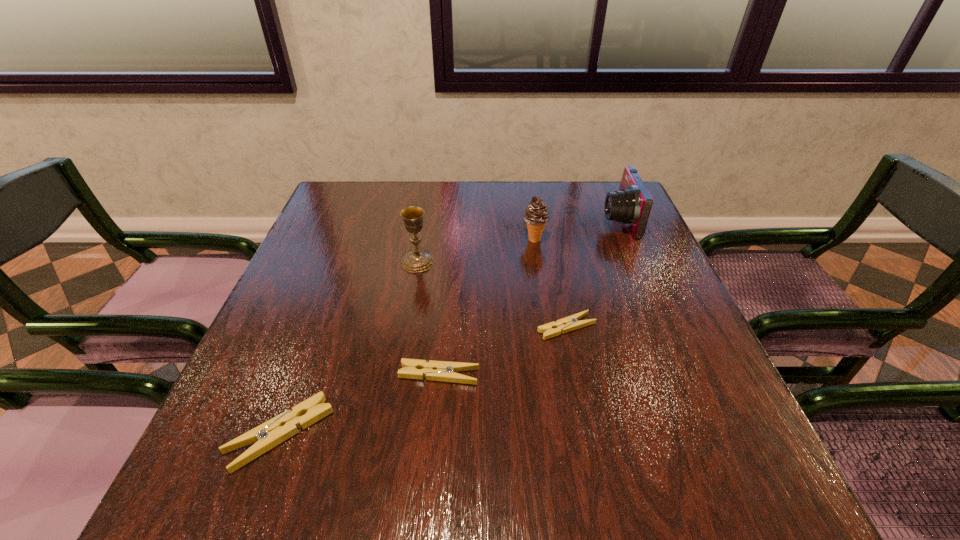
Find the location of a particular element. The image size is (960, 540). the leftmost clothespin is located at coordinates (268, 435).

Where is `the leftmost object`? The height and width of the screenshot is (540, 960). the leftmost object is located at coordinates pyautogui.click(x=268, y=435).

This screenshot has height=540, width=960. What are the coordinates of `the second tallest clothespin` in the screenshot? It's located at (444, 371).

You are a GUI agent. You are given a task and a screenshot of the screen. Output one action in this format:
    pyautogui.click(x=<x>, y=<y>)
    Task: Click on the second shortest object
    The height and width of the screenshot is (540, 960).
    Given the screenshot: What is the action you would take?
    pyautogui.click(x=444, y=371)

You are a GUI agent. You are given a task and a screenshot of the screen. Output one action in this format:
    pyautogui.click(x=<x>, y=<y>)
    Task: Click on the farthest clothespin
    
    Given the screenshot: What is the action you would take?
    pyautogui.click(x=570, y=323)

This screenshot has height=540, width=960. I want to click on the rightmost clothespin, so click(570, 323).

Where is `icecream`? The width and height of the screenshot is (960, 540). icecream is located at coordinates (536, 214).

The image size is (960, 540). I want to click on the rightmost object, so click(x=631, y=205).

At what (x,y) coordinates should I click in order to perform the action: click on chalice. Please return your answer as a coordinate pair (x, y). The height and width of the screenshot is (540, 960). Looking at the image, I should click on (416, 261).

This screenshot has width=960, height=540. What are the coordinates of `vacant space positioned on the back of the nearest object` in the screenshot? It's located at (321, 325).